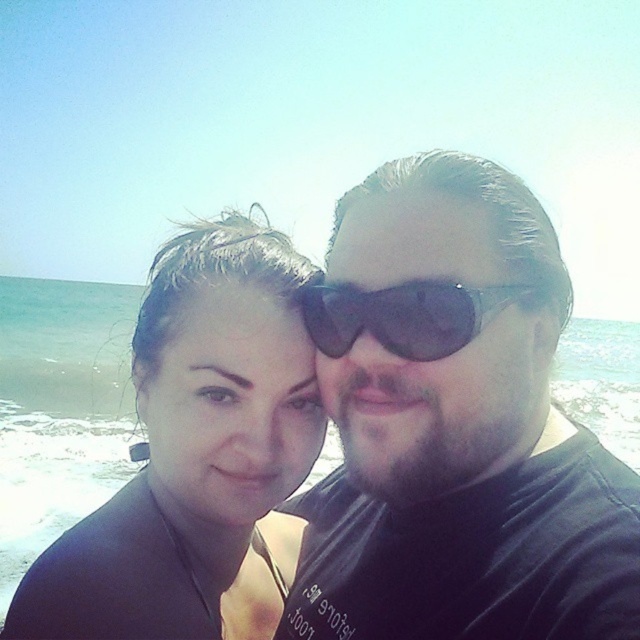
Which is below, matte black wetsuit at center or black plastic sunglasses at center?

Positioned lower is matte black wetsuit at center.

The height and width of the screenshot is (640, 640). Find the location of `matte black wetsuit at center`. matte black wetsuit at center is located at coordinates (196, 456).